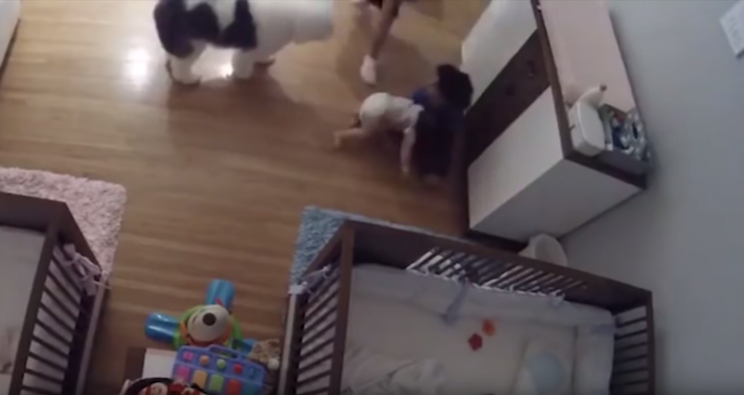
I want to click on space above dresser, so click(667, 22).